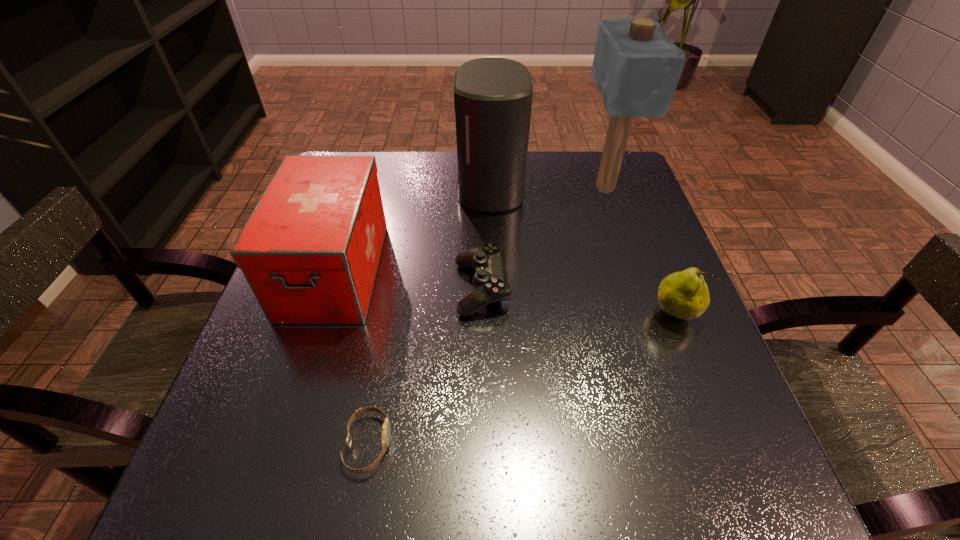
Locate an element on the screen. The height and width of the screenshot is (540, 960). vacant area situated 0.140m on the button side of the coffee maker is located at coordinates (403, 188).

This screenshot has height=540, width=960. I want to click on vacant space located on the button side of the coffee maker, so click(322, 188).

The height and width of the screenshot is (540, 960). Find the location of `free space located on the handle side of the first-aid kit`. free space located on the handle side of the first-aid kit is located at coordinates (295, 396).

What are the coordinates of `vacant space located on the front of the pear` in the screenshot? It's located at (741, 483).

You are a GUI agent. You are given a task and a screenshot of the screen. Output one action in this format:
    pyautogui.click(x=<x>, y=<y>)
    Task: Click on the vacant space located 0.070m on the right of the control
    The image size is (960, 540).
    Given the screenshot: What is the action you would take?
    pyautogui.click(x=543, y=288)

Where is `free space located on the face of the watch`? free space located on the face of the watch is located at coordinates (535, 444).

Identify the location of mallet located in the far edge section of the desktop. The height and width of the screenshot is (540, 960). (636, 67).

I want to click on coffee maker present at the far edge, so click(493, 96).

Where is `object that is positioned at the near edge`? object that is positioned at the near edge is located at coordinates (386, 429).

Where is `object located in the left edge section of the desktop`? object located in the left edge section of the desktop is located at coordinates click(x=310, y=250).